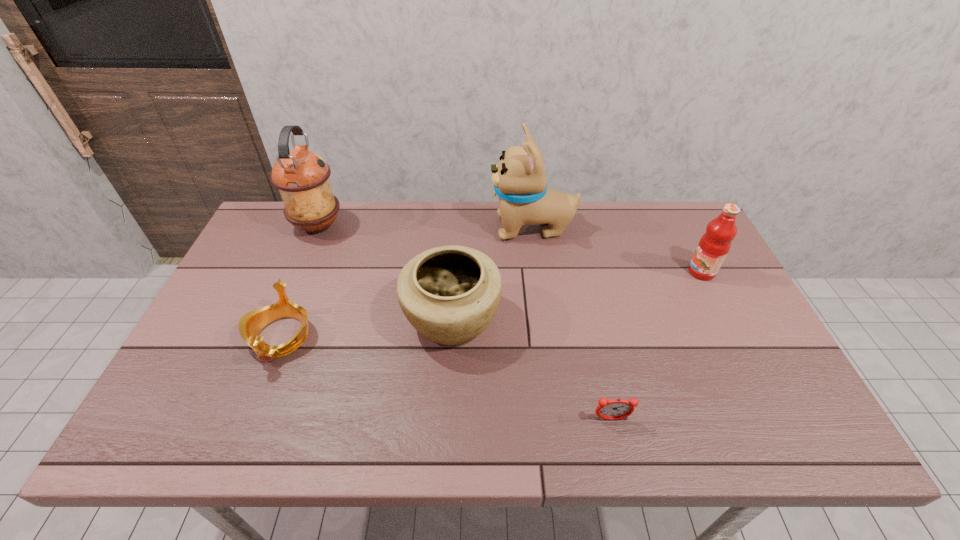
Where is `vacant space located 0.050m on the face of the puppy`? vacant space located 0.050m on the face of the puppy is located at coordinates (474, 228).

Locate an element on the screen. vacant space located on the face of the puppy is located at coordinates (x=393, y=228).

At what (x,y) coordinates should I click in order to perform the action: click on free space located 0.370m on the front label of the fourth shortest object. Please return your answer as a coordinate pair (x, y). Looking at the image, I should click on (564, 272).

Find the location of a particular element. This screenshot has width=960, height=540. vacant space located on the front label of the fourth shortest object is located at coordinates (564, 272).

You are a GUI agent. You are given a task and a screenshot of the screen. Output one action in this format:
    pyautogui.click(x=<x>, y=<y>)
    Task: Click on the vacant position located on the front label of the fourth shortest object
    
    Given the screenshot: What is the action you would take?
    pyautogui.click(x=648, y=272)

The image size is (960, 540). Identify the location of free space located 0.240m on the left of the pottery. (314, 319).

Identify the location of vacant region located 0.080m at the front emblem of the second shortest object. The width and height of the screenshot is (960, 540). (255, 401).

At what (x,y) coordinates should I click in order to perform the action: click on oil lamp present at the far edge. Please return your answer as a coordinate pair (x, y). Image resolution: width=960 pixels, height=540 pixels. Looking at the image, I should click on (302, 177).

You are a GUI agent. You are given a task and a screenshot of the screen. Output one action in this format:
    pyautogui.click(x=<x>, y=<y>)
    Task: Click on the puppy at the far edge
    
    Given the screenshot: What is the action you would take?
    pyautogui.click(x=519, y=179)

You are a GUI agent. You are given a task and a screenshot of the screen. Output one action in this format:
    pyautogui.click(x=<x>, y=<y>)
    Task: Click on the object at the near edge
    
    Given the screenshot: What is the action you would take?
    pyautogui.click(x=615, y=409)